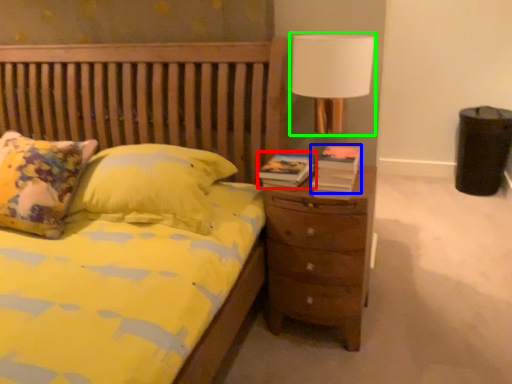
Question: Which object is positioned farthest from book (highlighted by a red box)? Select from book (highlighted by a blue box) and lamp (highlighted by a green box).

Choices:
 (A) book
 (B) lamp

Answer: (B)